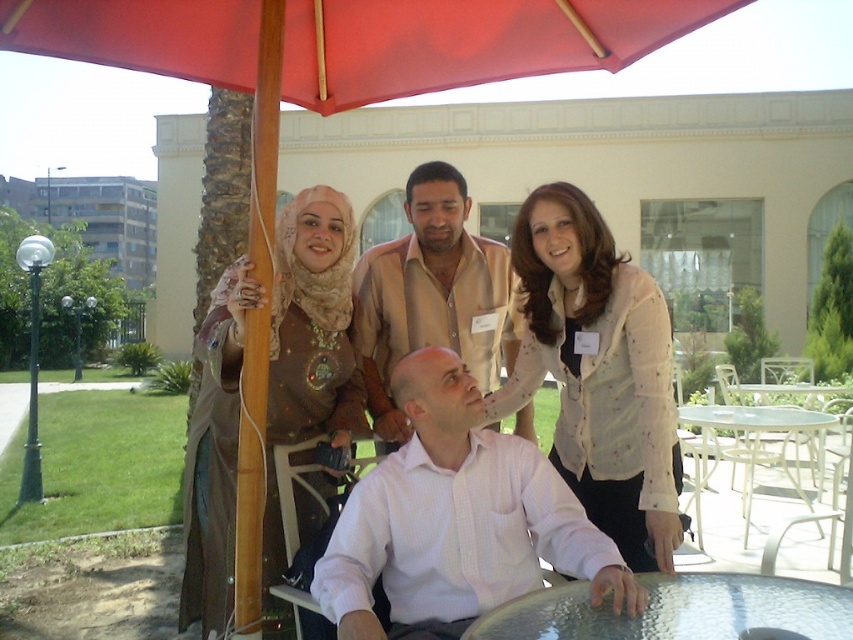
Question: Is matte beige shirt at center positioned at the back of wooden pole at left?

Choices:
 (A) yes
 (B) no

Answer: (A)

Question: Which of the following is the closest to the observer?

Choices:
 (A) white painted wood chair at lower right
 (B) white metal table at lower right
 (C) red fabric umbrella at upper center

Answer: (C)

Question: Does matte beige shirt at center appear under clear glass table at center?

Choices:
 (A) yes
 (B) no

Answer: (B)

Question: Can you confirm if white textured blouse at upper center is positioned below matte beige hijab at upper left?

Choices:
 (A) no
 (B) yes

Answer: (A)

Question: Which of the following is the closest to the observer?

Choices:
 (A) white metal table at lower right
 (B) red fabric umbrella at upper center
 (C) wooden pole at left

Answer: (B)

Question: Which object is farther from the camera taking this photo?

Choices:
 (A) matte beige hijab at upper left
 (B) wooden pole at left

Answer: (A)